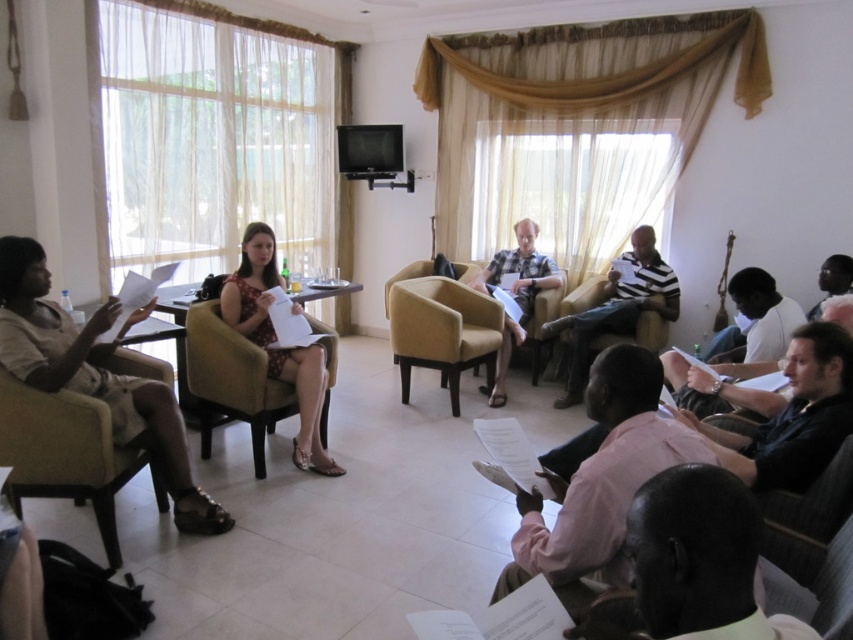
Question: Considering the real-world distances, which object is farthest from the beige fabric skirt at lower left?

Choices:
 (A) beige fabric armchair at lower left
 (B) velvet beige armchair at center
 (C) pink cotton shirt at lower center

Answer: (B)

Question: Which object is farther from the camera taking this photo?

Choices:
 (A) striped cotton shirt at center
 (B) matte floral dress at center
 (C) white paper at lower right

Answer: (A)

Question: Is velvet beige armchair at center positioned behind smooth skin face at lower right?

Choices:
 (A) no
 (B) yes

Answer: (B)

Question: Can you confirm if pink cotton shirt at lower center is positioned to the right of beige fabric skirt at lower left?

Choices:
 (A) no
 (B) yes

Answer: (B)

Question: Does velvet beige armchair at center have a greater width compared to matte floral dress at center?

Choices:
 (A) yes
 (B) no

Answer: (A)

Question: Among these points, which one is nearest to the camera?

Choices:
 (A) (776, 541)
 (B) (88, 380)
 (C) (524, 237)

Answer: (A)